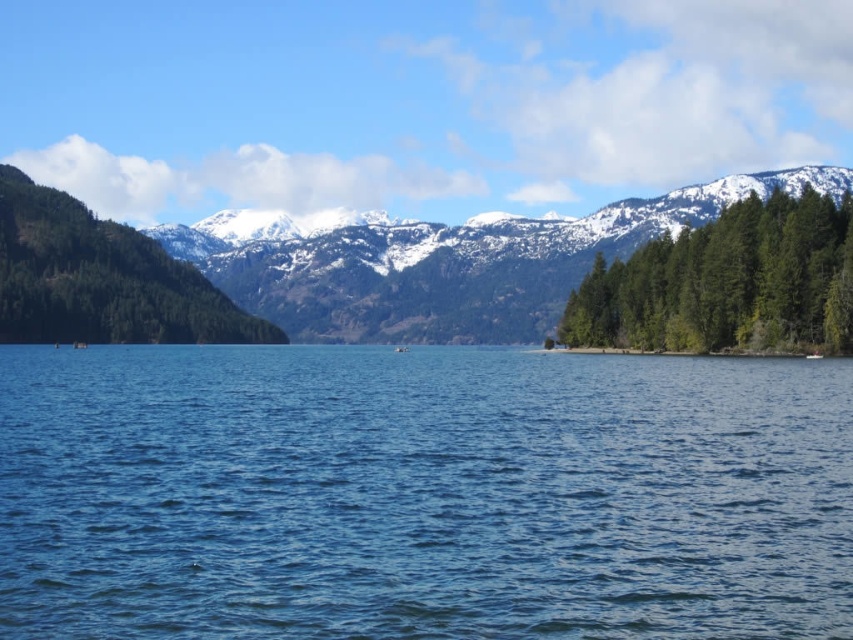
Question: Does blue water at center lie in front of green textured trees at right?

Choices:
 (A) no
 (B) yes

Answer: (B)

Question: Considering the relative positions of blue water at center and green textured trees at right in the image provided, where is blue water at center located with respect to green textured trees at right?

Choices:
 (A) right
 (B) left

Answer: (B)

Question: Does green textured trees at right come behind green textured forest at left?

Choices:
 (A) no
 (B) yes

Answer: (A)

Question: Which point is farther to the camera?

Choices:
 (A) green textured trees at right
 (B) snowy forested mountain at center

Answer: (B)

Question: Which point appears farthest from the camera in this image?

Choices:
 (A) (x=393, y=280)
 (B) (x=186, y=438)
 (C) (x=703, y=333)

Answer: (A)

Question: Which of the following is the farthest from the observer?

Choices:
 (A) green textured forest at left
 (B) snowy forested mountain at center
 (C) blue water at center

Answer: (B)